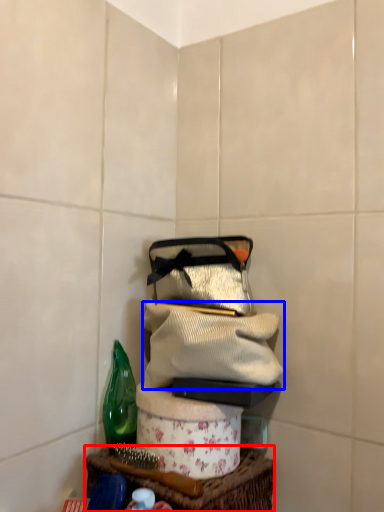
Question: Which object appears farthest to the camera in this image, table (highlighted by a red box) or clothing (highlighted by a blue box)?

Choices:
 (A) table
 (B) clothing

Answer: (B)